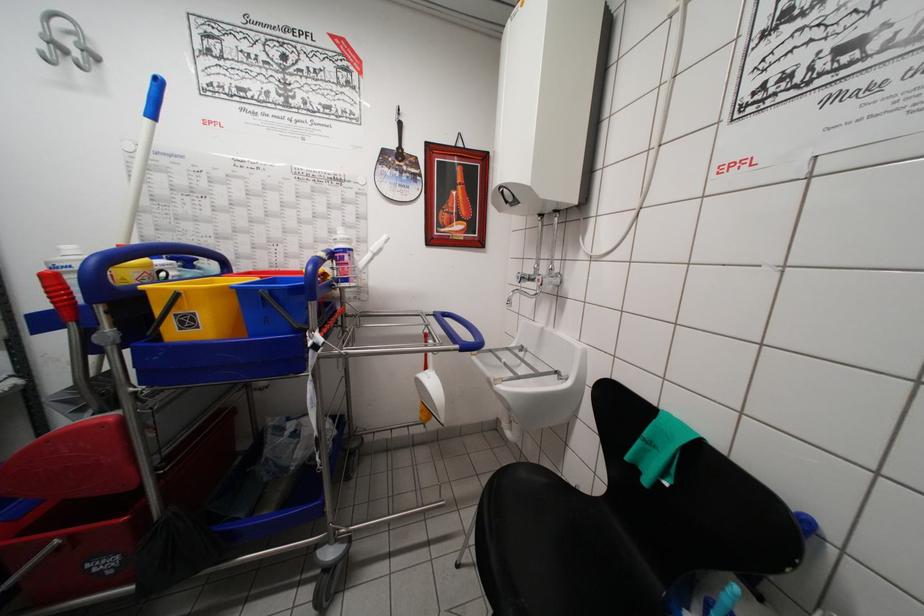
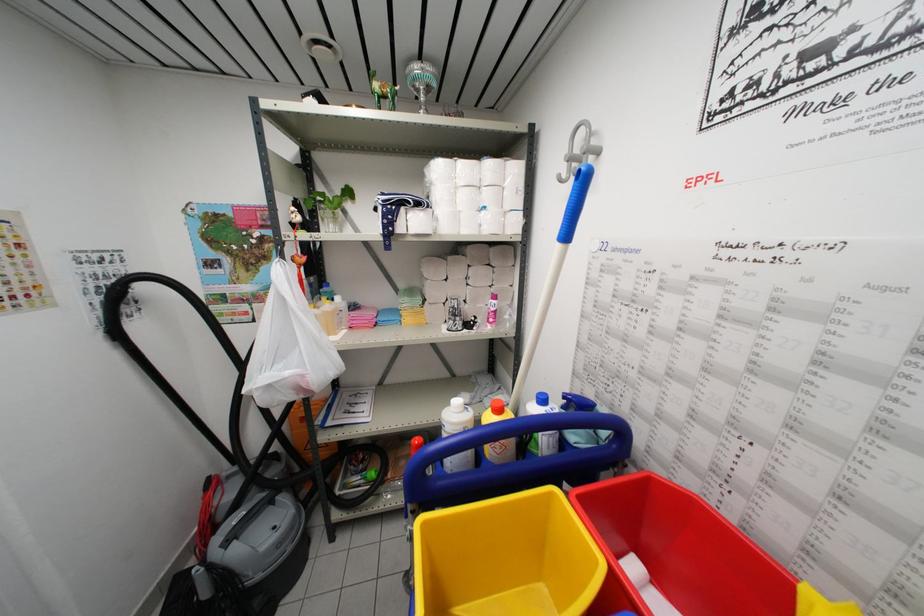
Find the pixel in the second image that matches point 92,51 in the first image.

(597, 148)